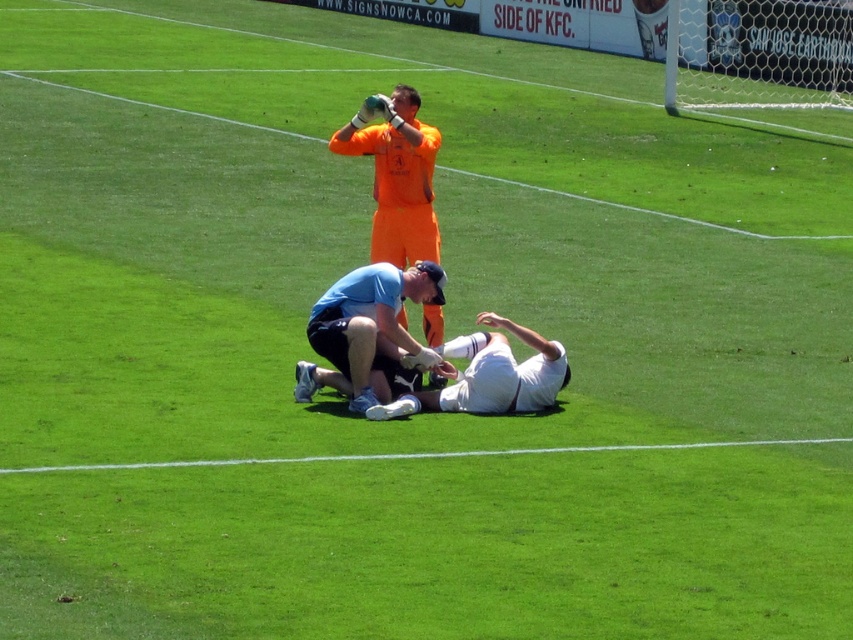
Between blue fabric knee at center and white matte uniform at center, which one has more height?

blue fabric knee at center is taller.

Can you confirm if blue fabric knee at center is positioned to the right of white matte uniform at center?

Incorrect, blue fabric knee at center is not on the right side of white matte uniform at center.

The height and width of the screenshot is (640, 853). Describe the element at coordinates (364, 326) in the screenshot. I see `blue fabric knee at center` at that location.

Locate an element on the screen. The image size is (853, 640). blue fabric knee at center is located at coordinates (364, 326).